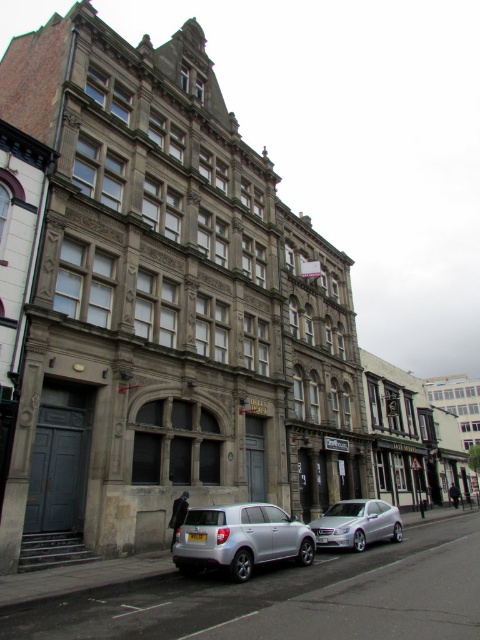
Question: Does satin silver suv at lower center appear over silver metallic car at center?

Choices:
 (A) yes
 (B) no

Answer: (A)

Question: Is satin silver suv at lower center thinner than silver metallic car at center?

Choices:
 (A) no
 (B) yes

Answer: (B)

Question: Which of the following is the closest to the observer?

Choices:
 (A) silver metallic car at center
 (B) satin silver suv at lower center

Answer: (B)

Question: Which point is closer to the camera?

Choices:
 (A) (393, 506)
 (B) (204, 548)

Answer: (B)

Question: Which point appears closest to the camera in this image?

Choices:
 (A) (200, 513)
 (B) (393, 515)

Answer: (A)

Question: Is satin silver suv at lower center bigger than silver metallic car at center?

Choices:
 (A) yes
 (B) no

Answer: (B)